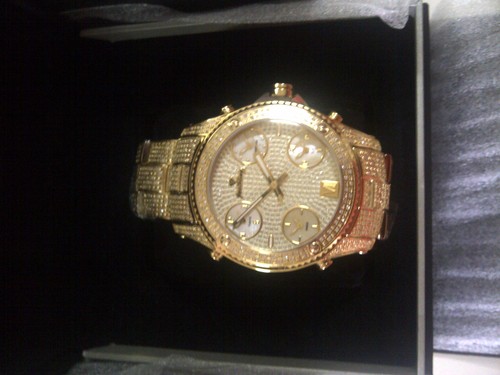
Find the location of `decorative knobs`. decorative knobs is located at coordinates (143, 243), (170, 235), (347, 252), (352, 168), (330, 244), (158, 161), (178, 170), (334, 174).